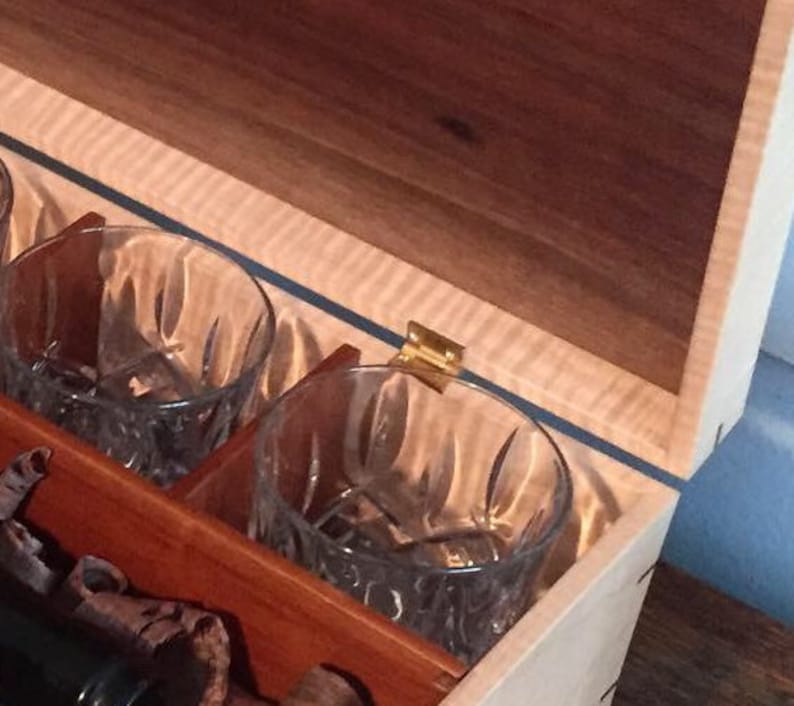
Locate an element on the screen. table is located at coordinates (661, 666).